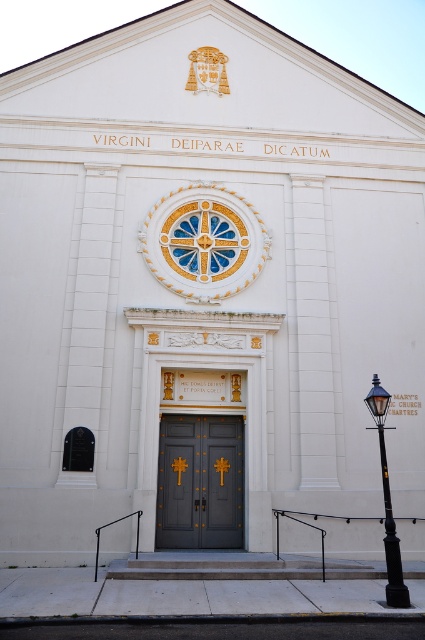
Is dark gray wood doors at center further to the viewer compared to black metal streetlight at lower right?

Yes.

Is dark gray wood doors at center above black metal streetlight at lower right?

Incorrect, dark gray wood doors at center is not positioned above black metal streetlight at lower right.

Between point (158, 492) and point (391, 572), which one is positioned behind?

The point (158, 492) is behind.

Image resolution: width=425 pixels, height=640 pixels. In order to click on dark gray wood doors at center in this screenshot , I will do `click(200, 483)`.